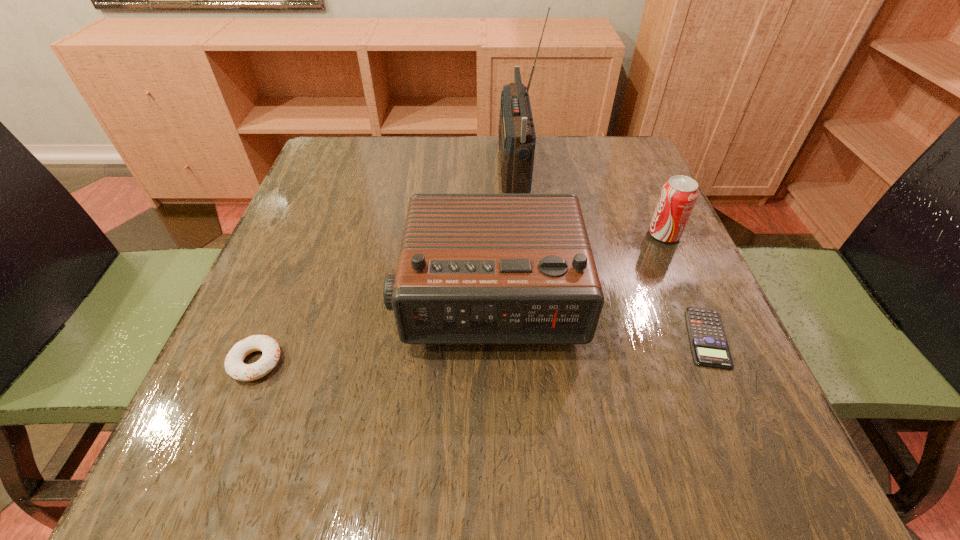
Identify the location of the tallest object. This screenshot has width=960, height=540. (517, 137).

This screenshot has width=960, height=540. In order to click on the farthest object in this screenshot , I will do `click(517, 137)`.

Where is `the second tallest object`? the second tallest object is located at coordinates (473, 268).

Identify the location of the nearer radio receiver. The width and height of the screenshot is (960, 540). [473, 268].

You are a GUI agent. You are given a task and a screenshot of the screen. Output one action in this format:
    pyautogui.click(x=<x>, y=<y>)
    Task: Click on the soda can
    This screenshot has height=540, width=960.
    Given the screenshot: What is the action you would take?
    pyautogui.click(x=678, y=196)

Image resolution: width=960 pixels, height=540 pixels. Identify the location of the fourth nearest object. (678, 196).

This screenshot has width=960, height=540. Identify the location of the leftmost object. (234, 366).

You are a GUI agent. You are given a task and a screenshot of the screen. Output one action in this format:
    pyautogui.click(x=<x>, y=<y>)
    Task: Click on the doughnut
    This screenshot has height=540, width=960.
    Given the screenshot: What is the action you would take?
    pyautogui.click(x=234, y=366)

Locate an element on the screen. The width and height of the screenshot is (960, 540). the shortest object is located at coordinates (709, 344).

Locate an element on the screen. The width and height of the screenshot is (960, 540). vacant area situated on the front-facing side of the farther radio receiver is located at coordinates (361, 167).